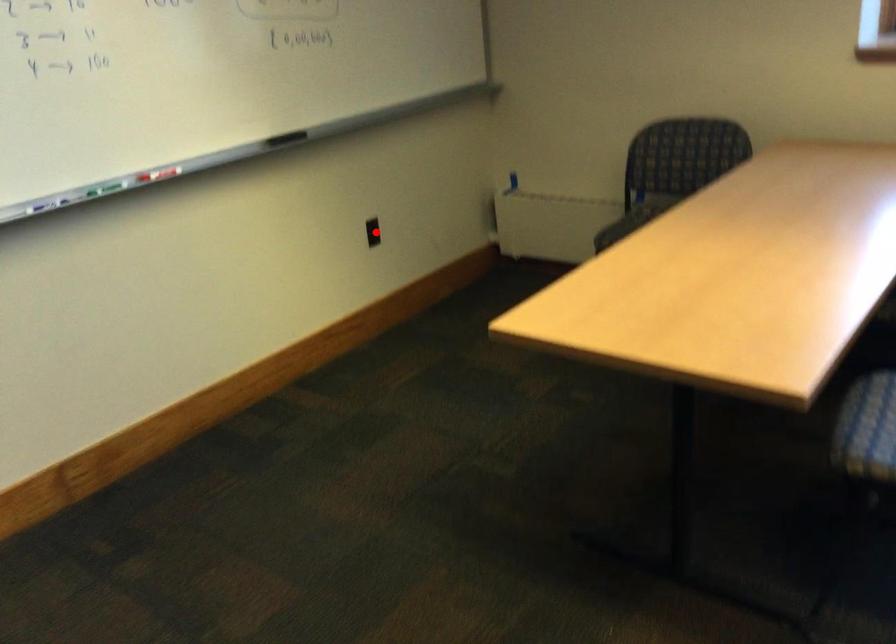
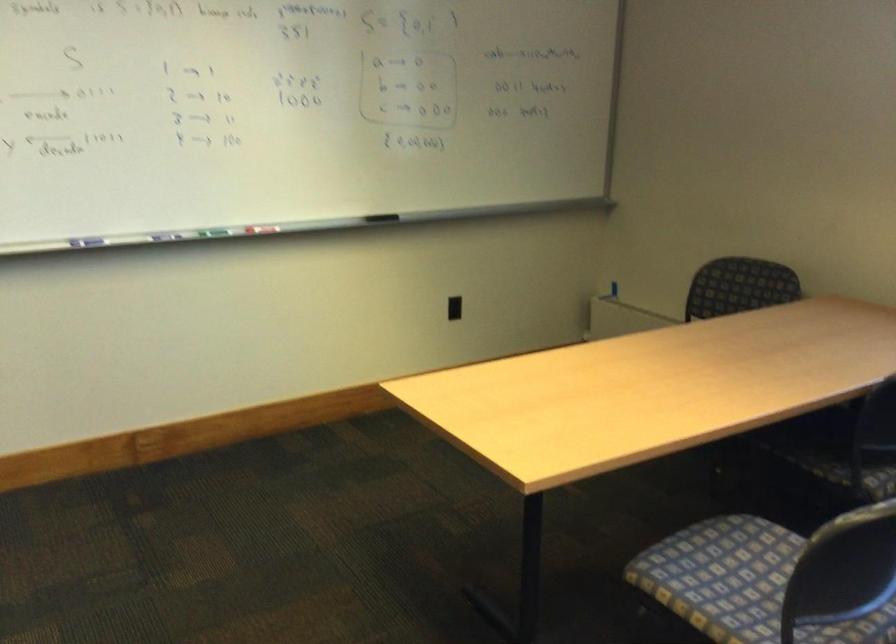
In the second image, find the point that corresponds to the highlighted location in the first image.

(453, 308)